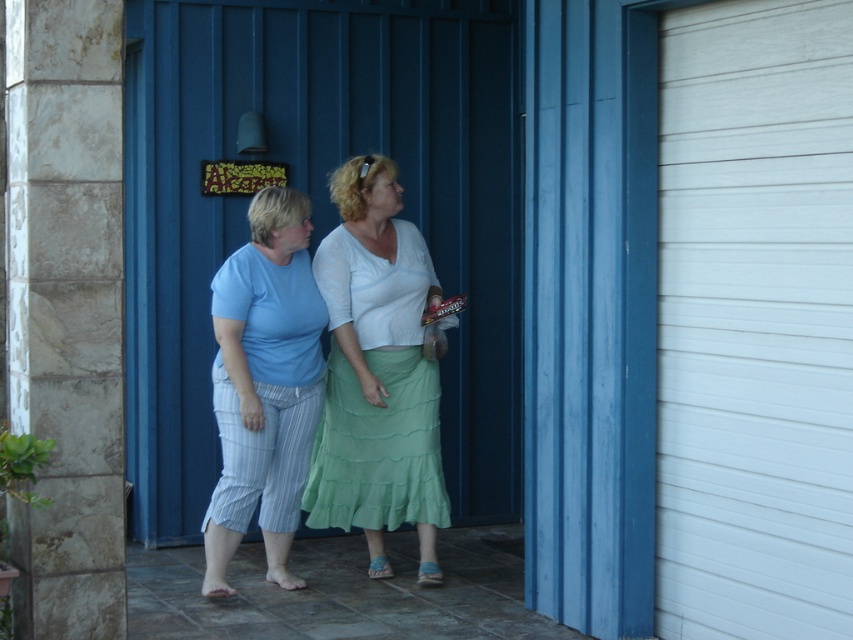
Question: Which object appears farthest from the camera in this image?

Choices:
 (A) blue metal/glass door at center
 (B) light green textured skirt at center

Answer: (A)

Question: Among these objects, which one is farthest from the camera?

Choices:
 (A) blue metal/glass door at center
 (B) light green textured skirt at center
 (C) blue striped pants at left

Answer: (A)

Question: Can you confirm if light green textured skirt at center is positioned below blue striped pants at left?

Choices:
 (A) no
 (B) yes

Answer: (A)

Question: Is the position of light green textured skirt at center more distant than that of blue striped pants at left?

Choices:
 (A) no
 (B) yes

Answer: (B)

Question: Estimate the real-world distances between objects in this image. Which object is closer to the blue striped pants at left?

Choices:
 (A) light green textured skirt at center
 (B) blue metal/glass door at center

Answer: (A)

Question: Can you confirm if blue metal/glass door at center is positioned below light green textured skirt at center?

Choices:
 (A) yes
 (B) no

Answer: (B)